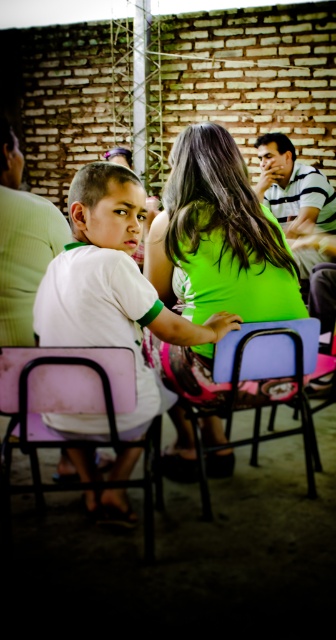
You are a photographer trying to capture a photo of the white matte shirt at center and the pink matte chair at lower left. Which object should you focus on first if you want to ensure both are in sharp focus, considering their sizes?

The white matte shirt at center has a greater height compared to the pink matte chair at lower left, so you should focus on the white matte shirt at center first to ensure both are in sharp focus.

You are a photographer setting up for a group photo. You have a camera that can focus on objects up to 1 meter in height. The white matte shirt at center and the pink matte chair at lower left are in your frame. Based on their sizes, which object is more likely to be in focus?

The white matte shirt at center is larger in size compared to the pink matte chair at lower left. Since the camera can focus on objects up to 1 meter in height, the white matte shirt at center is more likely to be in focus as it is larger and within the focus range.